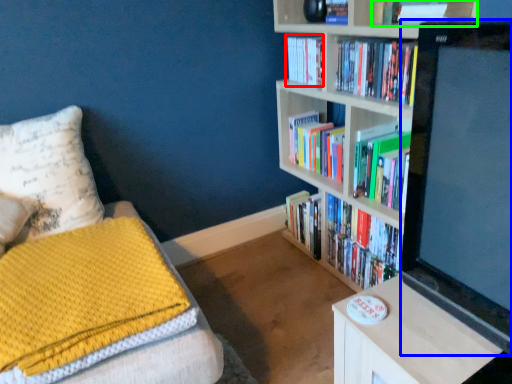
Question: Considering the real-world distances, which object is closest to book (highlighted by a red box)? computer monitor (highlighted by a blue box) or book (highlighted by a green box).

Choices:
 (A) computer monitor
 (B) book

Answer: (B)